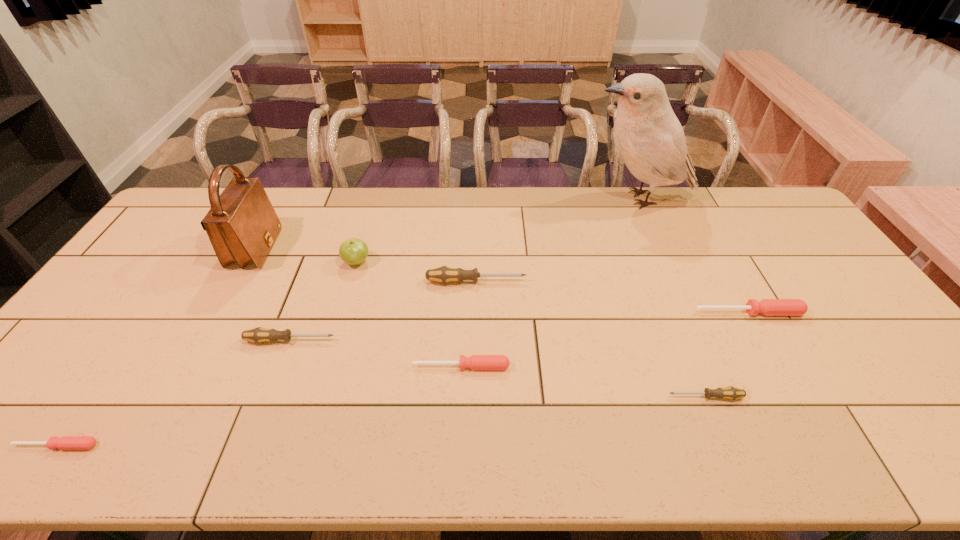
Locate an element on the screen. The height and width of the screenshot is (540, 960). the farthest object is located at coordinates (x=647, y=134).

The image size is (960, 540). Find the location of `the tallest object`. the tallest object is located at coordinates (647, 134).

Find the location of a particular element. shoulder bag is located at coordinates (242, 225).

At what (x,y) coordinates should I click in order to perform the action: click on the eighth shortest object. Please return your answer as a coordinate pair (x, y). Looking at the image, I should click on (242, 225).

The image size is (960, 540). Find the location of `green apple`. green apple is located at coordinates (354, 251).

Locate an element on the screen. the seventh shortest object is located at coordinates (354, 251).

Image resolution: width=960 pixels, height=540 pixels. In order to click on the farthest gray screwdriver in this screenshot , I will do `click(443, 274)`.

I want to click on the sixth shortest object, so click(x=443, y=274).

Where is `the second nearest gray screwdriver`? The image size is (960, 540). the second nearest gray screwdriver is located at coordinates (258, 335).

Find the location of a particular element. This screenshot has width=960, height=540. the fifth screwdriver from right to left is located at coordinates (258, 335).